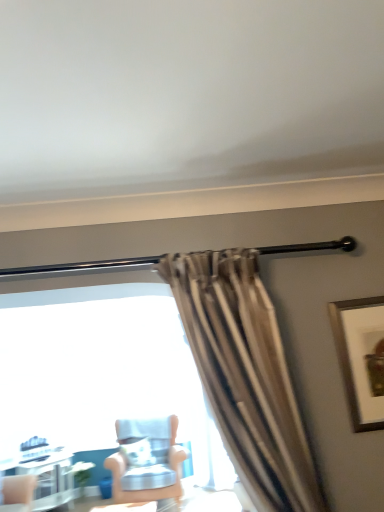
Question: Considering the relative sizes of white glossy table at lower left and light blue fabric chair at center in the image provided, is white glossy table at lower left shorter than light blue fabric chair at center?

Choices:
 (A) yes
 (B) no

Answer: (A)

Question: Is white glossy table at lower left bigger than light blue fabric chair at center?

Choices:
 (A) no
 (B) yes

Answer: (A)

Question: Is white glossy table at lower left taller than light blue fabric chair at center?

Choices:
 (A) yes
 (B) no

Answer: (B)

Question: From the image's perspective, is white glossy table at lower left beneath light blue fabric chair at center?

Choices:
 (A) yes
 (B) no

Answer: (A)

Question: From a real-world perspective, is white glossy table at lower left physically above light blue fabric chair at center?

Choices:
 (A) no
 (B) yes

Answer: (A)

Question: Is white glossy table at lower left turned away from light blue fabric chair at center?

Choices:
 (A) no
 (B) yes

Answer: (A)

Question: Are light blue fabric chair at center and wooden framed artwork at upper right located far from each other?

Choices:
 (A) no
 (B) yes

Answer: (B)

Question: Does light blue fabric chair at center come in front of wooden framed artwork at upper right?

Choices:
 (A) no
 (B) yes

Answer: (A)

Question: Considering the relative sizes of light blue fabric chair at center and wooden framed artwork at upper right in the image provided, is light blue fabric chair at center wider than wooden framed artwork at upper right?

Choices:
 (A) no
 (B) yes

Answer: (B)

Question: Is light blue fabric chair at center facing away from wooden framed artwork at upper right?

Choices:
 (A) yes
 (B) no

Answer: (B)

Question: Considering the relative positions of light blue fabric chair at center and wooden framed artwork at upper right in the image provided, is light blue fabric chair at center to the left of wooden framed artwork at upper right from the viewer's perspective?

Choices:
 (A) no
 (B) yes

Answer: (B)

Question: Is light blue fabric chair at center bigger than wooden framed artwork at upper right?

Choices:
 (A) no
 (B) yes

Answer: (B)

Question: Is wooden framed artwork at upper right behind light blue fabric chair at center?

Choices:
 (A) yes
 (B) no

Answer: (B)